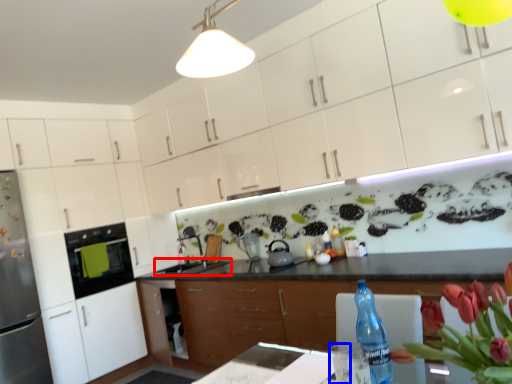
Question: Which point is further to the camera, sink (highlighted by a red box) or water (highlighted by a blue box)?

Choices:
 (A) sink
 (B) water

Answer: (A)